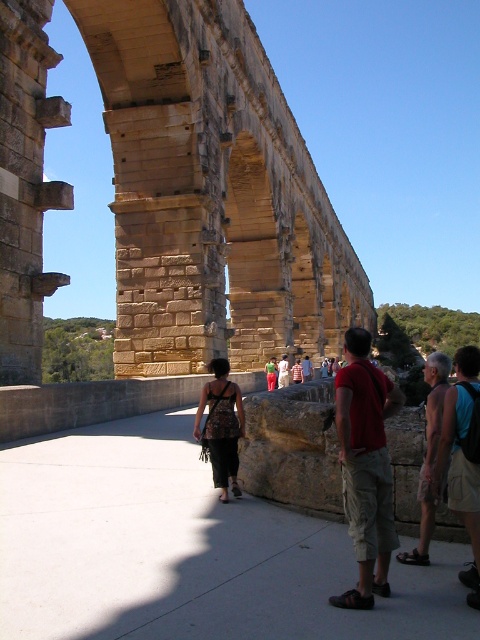
Does khaki cotton shorts at lower right have a smaller size compared to textured brown dress at center?

Indeed, khaki cotton shorts at lower right has a smaller size compared to textured brown dress at center.

Locate an element on the screen. This screenshot has height=640, width=480. khaki cotton shorts at lower right is located at coordinates (462, 460).

In the scene shown: Does khaki cotton shorts at lower right have a larger size compared to brown leather backpack at center?

Indeed, khaki cotton shorts at lower right has a larger size compared to brown leather backpack at center.

In order to click on khaki cotton shorts at lower right in this screenshot , I will do `click(462, 460)`.

In the scene shown: Can you confirm if textured brown dress at center is positioned to the left of tan shorts at lower right?

Indeed, textured brown dress at center is positioned on the left side of tan shorts at lower right.

Does point (230, 412) come closer to viewer compared to point (448, 365)?

No.

Identify the location of textured brown dress at center. (220, 426).